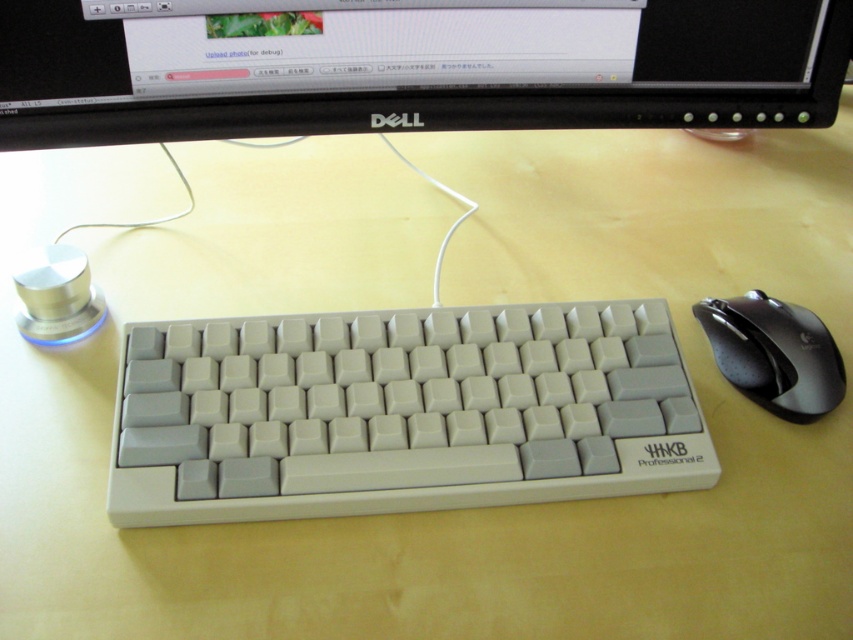
Between white plastic keyboard at center and black plastic mouse at right, which one is positioned higher?

black plastic mouse at right is higher up.

Can you confirm if white plastic keyboard at center is positioned to the right of black plastic mouse at right?

No, white plastic keyboard at center is not to the right of black plastic mouse at right.

Between point (167, 506) and point (747, 388), which one is positioned in front?

Positioned in front is point (167, 506).

In order to click on white plastic keyboard at center in this screenshot , I will do `click(401, 412)`.

Which of these two, white plastic keyboard at center or black plastic monitor at upper center, stands taller?

white plastic keyboard at center

Between point (469, 381) and point (756, 1), which one is positioned behind?

The point (756, 1) is more distant.

Locate an element on the screen. white plastic keyboard at center is located at coordinates (401, 412).

What do you see at coordinates (410, 67) in the screenshot? This screenshot has width=853, height=640. I see `black plastic monitor at upper center` at bounding box center [410, 67].

Does black plastic monitor at upper center have a lesser width compared to black plastic mouse at right?

No.

This screenshot has height=640, width=853. In order to click on black plastic monitor at upper center in this screenshot , I will do `click(410, 67)`.

At what (x,y) coordinates should I click in order to perform the action: click on black plastic monitor at upper center. Please return your answer as a coordinate pair (x, y). This screenshot has height=640, width=853. Looking at the image, I should click on (410, 67).